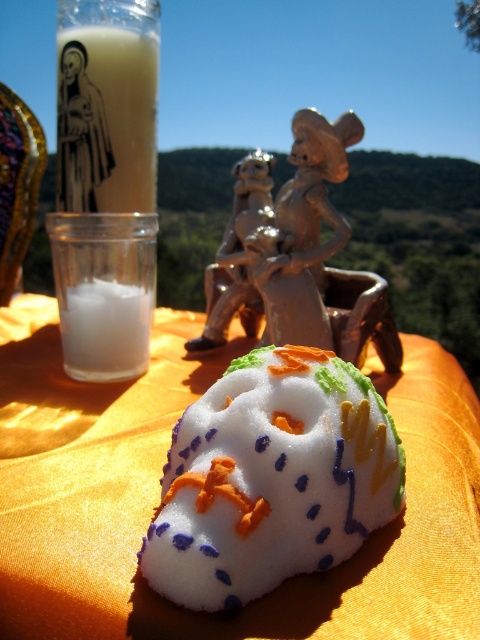
You are standing in front of the table with the orange cloth. There are two points marked on the table. One is at point (160, 464) and the other is at point (115, 356). Which point is closer to you?

Point (160, 464) is in front of point (115, 356), so it is closer to you.

You are a photographer standing at the edge of the table. You want to take a closeup photo of the white sugar skull at center. What is the minimum distance you should set your camera lens to focus on?

The white sugar skull at center is 9.87 inches away from the viewer, so the camera lens should be focused at 9.87 inches to capture the closeup.